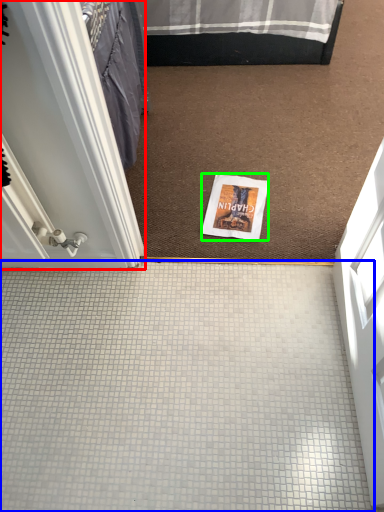
Question: Which is farther away from door (highlighted by a red box)? plain (highlighted by a blue box) or magazine (highlighted by a green box)?

Choices:
 (A) plain
 (B) magazine

Answer: (B)